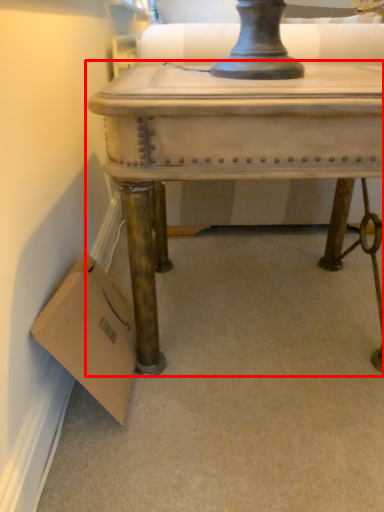
Question: From the image's perspective, where is table (annotated by the red box) located in relation to cardboard box in the image?

Choices:
 (A) above
 (B) below

Answer: (A)